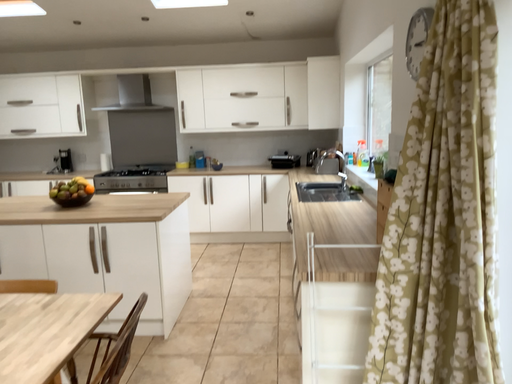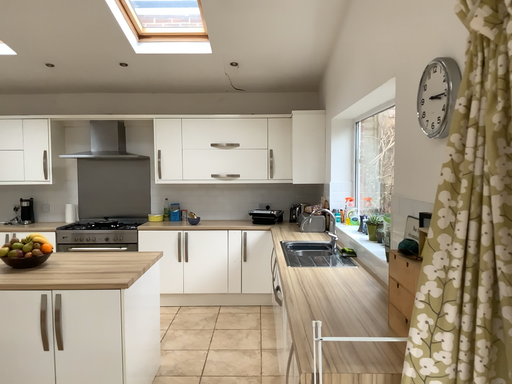
Question: Which way did the camera rotate in the video?

Choices:
 (A) rotated upward
 (B) rotated downward

Answer: (A)